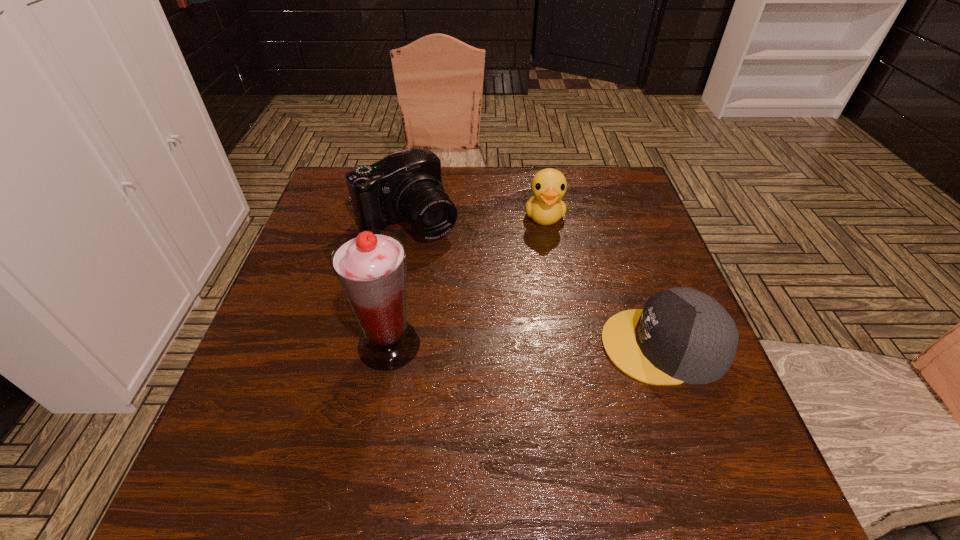
You are a GUI agent. You are given a task and a screenshot of the screen. Output one action in this format:
    pyautogui.click(x=<x>, y=<y>)
    Task: Click on the vacant region at the far edge
    
    Given the screenshot: What is the action you would take?
    pyautogui.click(x=457, y=184)

The width and height of the screenshot is (960, 540). In order to click on vacant area at the left edge in this screenshot , I will do `click(313, 220)`.

In the image, there is a desktop. Where is `vacant space at the right edge`? This screenshot has width=960, height=540. vacant space at the right edge is located at coordinates (646, 249).

You are a GUI agent. You are given a task and a screenshot of the screen. Output one action in this format:
    pyautogui.click(x=<x>, y=<y>)
    Task: Click on the vacant space at the far right corner of the desktop
    
    Given the screenshot: What is the action you would take?
    pyautogui.click(x=622, y=174)

Locate an element on the screen. This screenshot has height=540, width=960. unoccupied area between the cap and the smoothie is located at coordinates (526, 345).

Locate an element on the screen. This screenshot has height=540, width=960. vacant point located between the third object from left to right and the smoothie is located at coordinates (467, 280).

This screenshot has height=540, width=960. Find the location of `unoccupied position between the rightmost object and the camera`. unoccupied position between the rightmost object and the camera is located at coordinates (536, 284).

You are a GUI agent. You are given a task and a screenshot of the screen. Output one action in this format:
    pyautogui.click(x=<x>, y=<y>)
    Task: Click on the free area in between the cap and the smoothie
    The height and width of the screenshot is (540, 960).
    Given the screenshot: What is the action you would take?
    pyautogui.click(x=526, y=345)

Find the location of a particular element. This screenshot has width=960, height=540. blank region between the second object from right to left and the camera is located at coordinates (476, 219).

Locate which object ranks third in proximity to the third object from left to right. Please provide its 2D coordinates. Your answer should be formatted as a tuple, i.e. [(x, y)], where the tuple contains the x and y coordinates of a point satisfying the conditions above.

[(370, 266)]